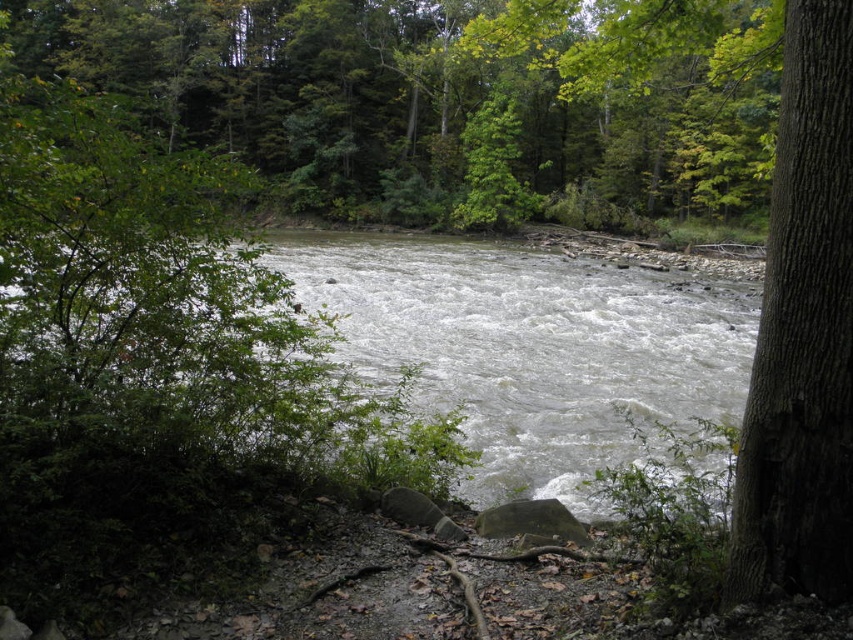
Question: Can you confirm if green leafy tree at center is positioned below smooth brown tree trunk at right?

Choices:
 (A) yes
 (B) no

Answer: (B)

Question: Considering the real-world distances, which object is closest to the smooth brown tree trunk at right?

Choices:
 (A) green leafy tree at center
 (B) white frothy water at center

Answer: (B)

Question: Can you confirm if green leafy tree at center is smaller than white frothy water at center?

Choices:
 (A) no
 (B) yes

Answer: (A)

Question: Estimate the real-world distances between objects in this image. Which object is closer to the white frothy water at center?

Choices:
 (A) smooth brown tree trunk at right
 (B) green leafy tree at center

Answer: (B)

Question: Considering the relative positions of green leafy tree at center and smooth brown tree trunk at right in the image provided, where is green leafy tree at center located with respect to smooth brown tree trunk at right?

Choices:
 (A) right
 (B) left

Answer: (B)

Question: Among these objects, which one is nearest to the camera?

Choices:
 (A) white frothy water at center
 (B) smooth brown tree trunk at right
 (C) green leafy tree at center

Answer: (B)